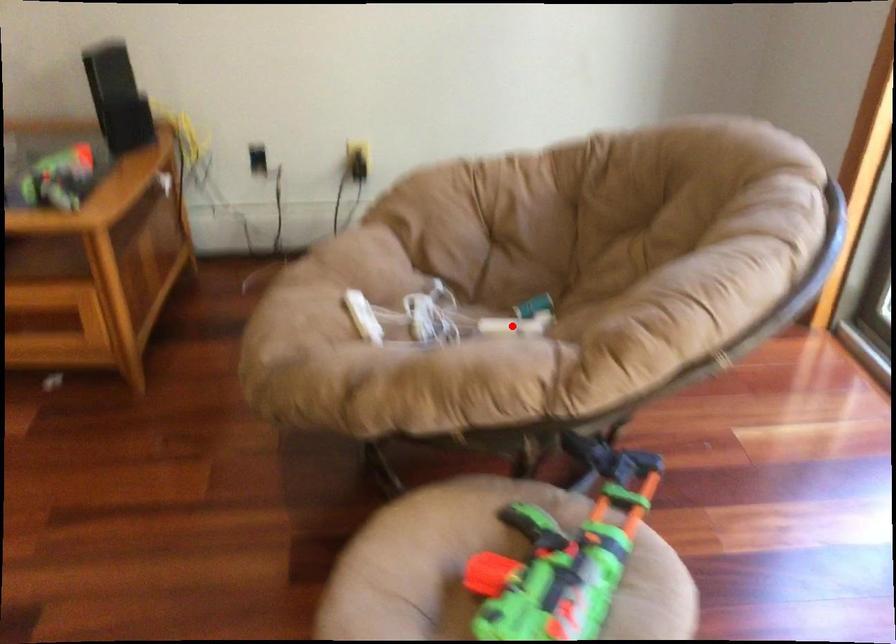
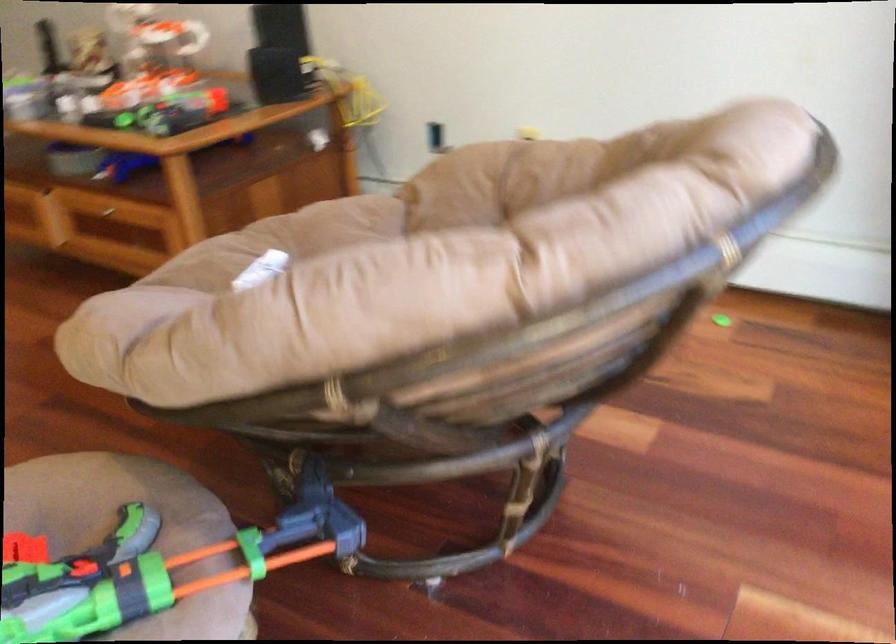
Question: I am providing you with two images of the same scene from different viewpoints. A red point is marked on the first image. At the location where the point appears in image 1, is it still visible in image 2?

Choices:
 (A) Yes
 (B) No

Answer: (B)